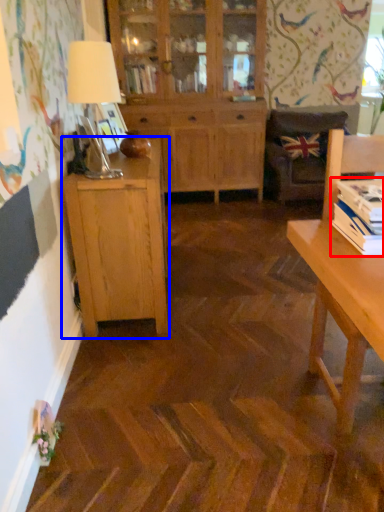
Question: Among these objects, which one is farthest to the camera, book (highlighted by a red box) or cabinetry (highlighted by a blue box)?

Choices:
 (A) book
 (B) cabinetry

Answer: (B)